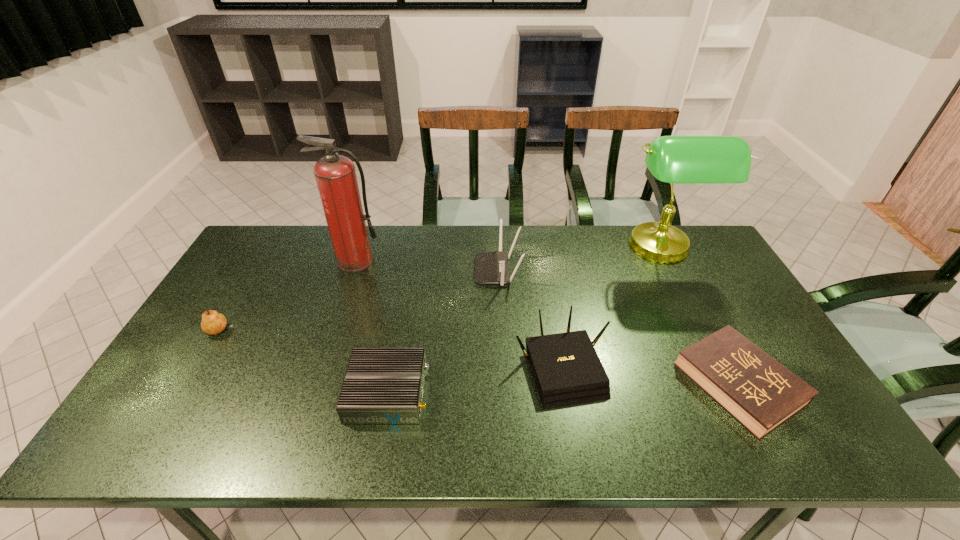
This screenshot has height=540, width=960. Identify the location of fire extinguisher. (335, 175).

Find the location of a particular element. lamp is located at coordinates (672, 159).

You are a GUI agent. You are given a task and a screenshot of the screen. Output one action in this format:
    pyautogui.click(x=<x>, y=<y>)
    Task: Click on the tallest router
    
    Given the screenshot: What is the action you would take?
    pyautogui.click(x=490, y=267)

Find the location of a particular element. The image size is (960, 540). the fifth shortest object is located at coordinates (490, 267).

Where is `the second tallest router`? The image size is (960, 540). the second tallest router is located at coordinates (566, 368).

Find the location of `pear`. pear is located at coordinates 212,323.

The image size is (960, 540). I want to click on the leftmost object, so click(x=212, y=323).

Locate an element on the screen. the shortest router is located at coordinates (382, 385).

In order to click on the leftmost router in this screenshot , I will do click(382, 385).

The image size is (960, 540). I want to click on hardback book, so click(761, 394).